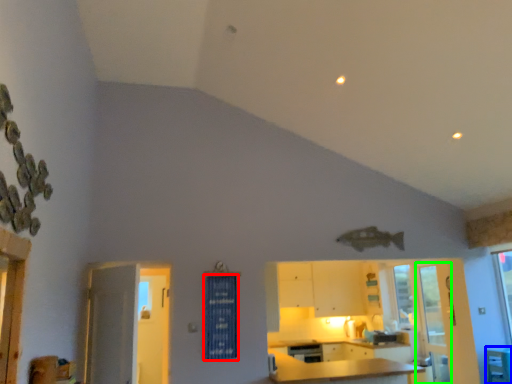
Question: Estimate the real-world distances between objects in this image. Which object is farther from curtain (highlighted by a red box), table (highlighted by a blue box) or screen door (highlighted by a green box)?

Choices:
 (A) table
 (B) screen door

Answer: (A)